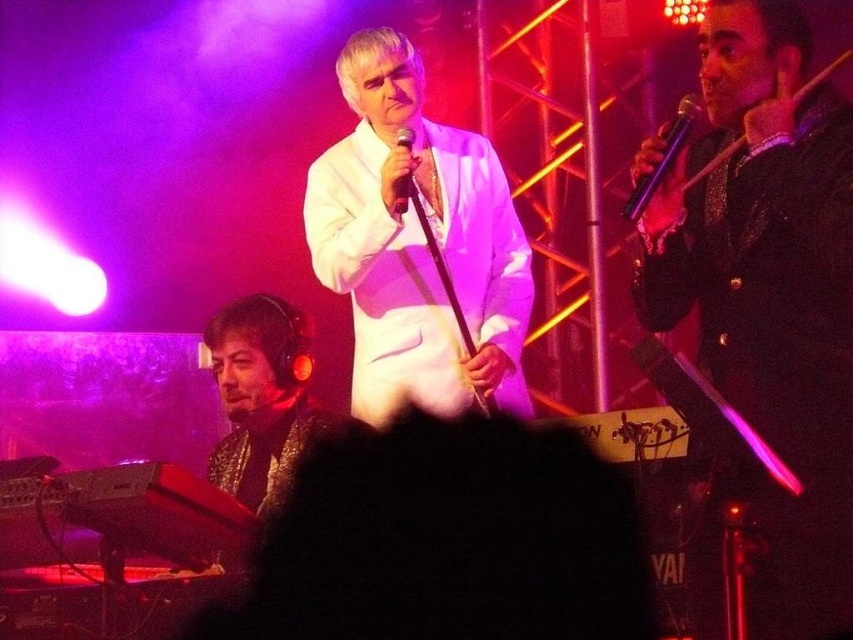
From the picture: You are a photographer at the concert and want to capture a photo that includes both the white satin suit at center and the purple metallic microphone at upper right. Based on their positions, which object should be placed on the left side of the photo to ensure both are visible?

The white satin suit at center should be placed on the left side of the photo because it is positioned on the left side of the purple metallic microphone at upper right.

You are a photographer at the concert. You need to take a photo that includes both the shiny black jacket at center and the black matte microphone at center. Which object should you position to the right side of your frame to ensure both are visible?

You should position the shiny black jacket at center to the right side of your frame since it is already to the right of the black matte microphone at center, ensuring both are included in the photo.

You are a stagehand preparing to adjust the microphone stand for the performer in the white satin suit at center. The purple metallic microphone at upper right is currently positioned above the performer. Is the microphone stand too tall for the performer, requiring adjustment?

The white satin suit at center is taller than the purple metallic microphone at upper right, so the microphone stand is not too tall. The performer in the white satin suit at center is taller than the microphone, so the current height should be suitable.